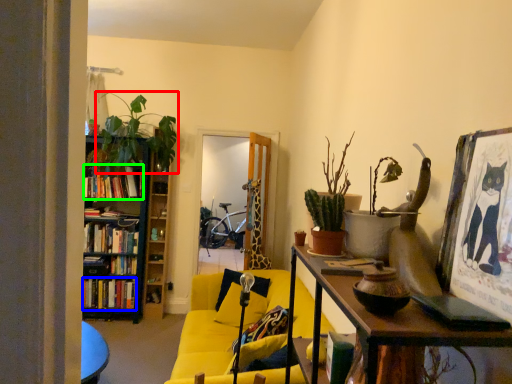
Question: Which object is positioned farthest from houseplant (highlighted by a red box)? Select from book (highlighted by a blue box) and book (highlighted by a green box).

Choices:
 (A) book
 (B) book

Answer: (A)